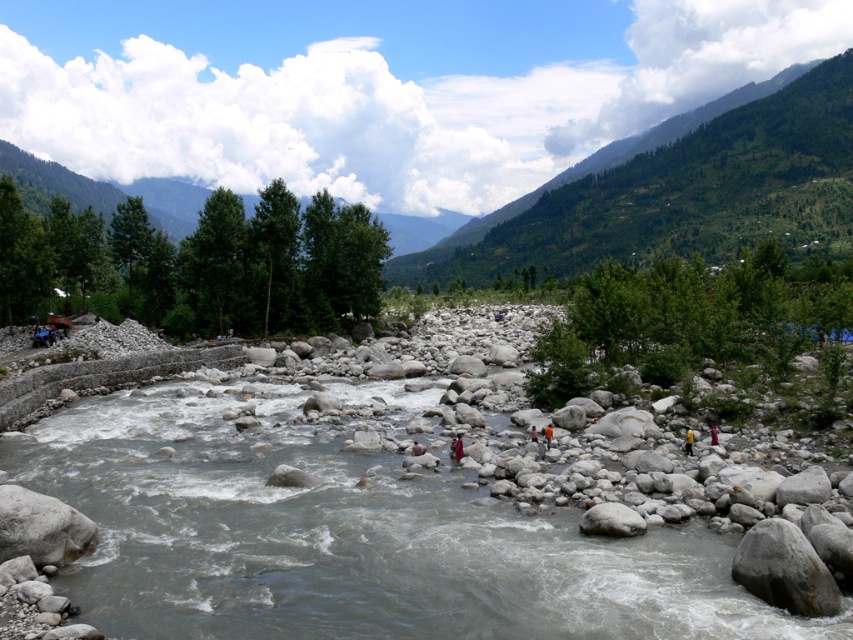
Is point (570, 248) farther from viewer compared to point (456, 452)?

Yes, it is.

From the picture: Can you confirm if green leafy mountain at upper right is positioned to the left of red fabric person at center?

In fact, green leafy mountain at upper right is to the right of red fabric person at center.

Where is `green leafy mountain at upper right`? The height and width of the screenshot is (640, 853). green leafy mountain at upper right is located at coordinates (682, 192).

Which of these two, red fabric person at center or yellow fabric at center, stands taller?

Standing taller between the two is yellow fabric at center.

Is red fabric person at center positioned in front of yellow fabric at center?

That is False.

This screenshot has width=853, height=640. What do you see at coordinates (456, 448) in the screenshot?
I see `red fabric person at center` at bounding box center [456, 448].

Identify the location of red fabric person at center. (456, 448).

Is green leafy mountain at upper right taller than yellow fabric at center?

Correct, green leafy mountain at upper right is much taller as yellow fabric at center.

Who is shorter, green leafy mountain at upper right or yellow fabric at center?

Standing shorter between the two is yellow fabric at center.

Find the location of `green leafy mountain at upper right`. green leafy mountain at upper right is located at coordinates (682, 192).

The width and height of the screenshot is (853, 640). Identify the location of green leafy mountain at upper right. (682, 192).